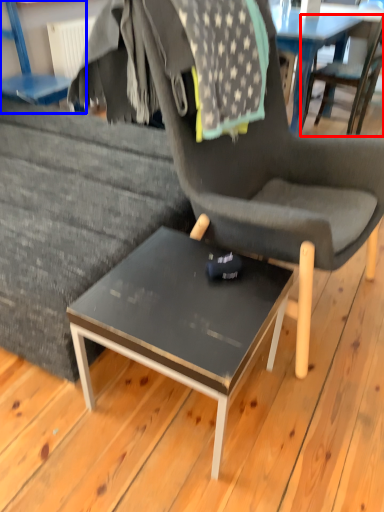
Question: Which of the following is the closest to the observer, chair (highlighted by a red box) or chair (highlighted by a blue box)?

Choices:
 (A) chair
 (B) chair

Answer: (B)